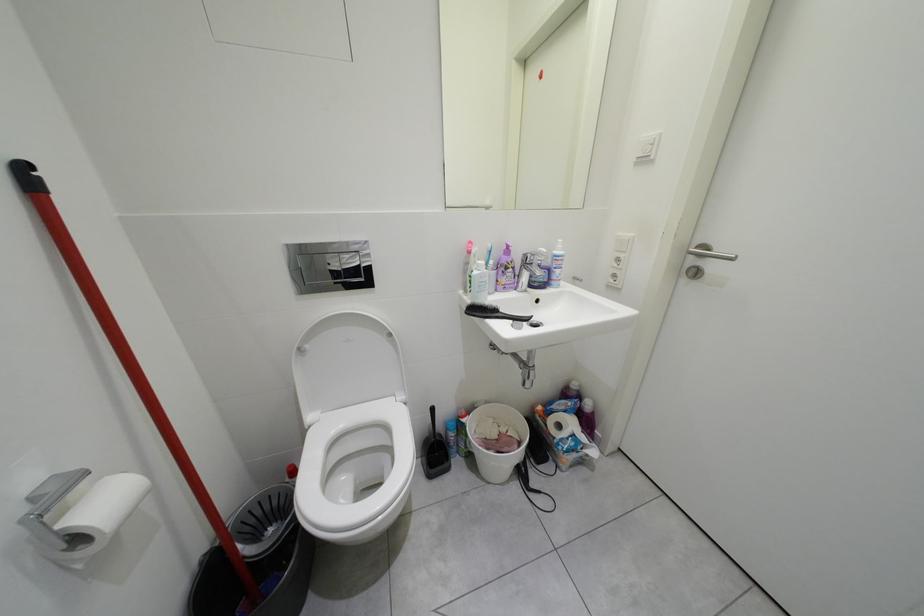
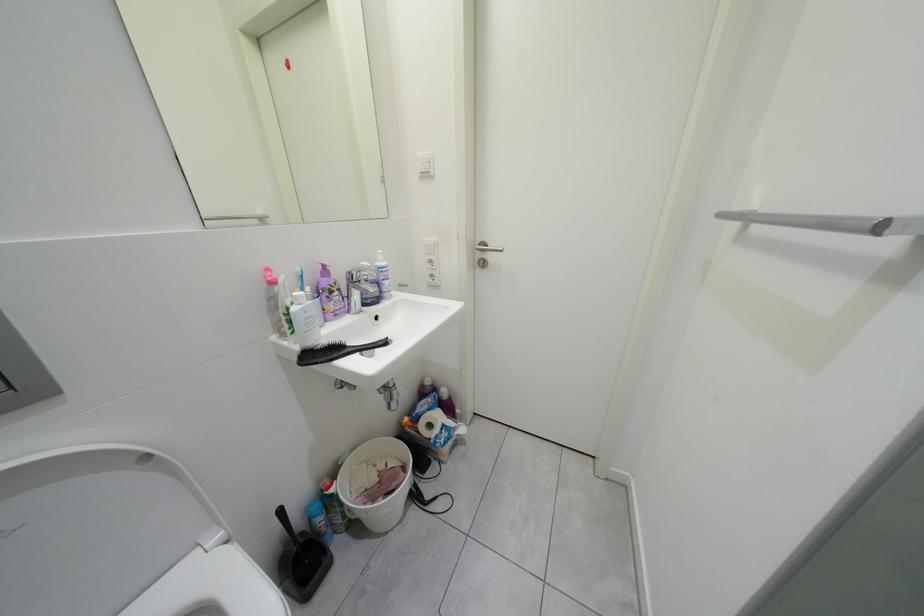
Question: The first image is from the beginning of the video and the second image is from the end. How did the camera likely rotate when shooting the video?

Choices:
 (A) Left
 (B) Right
 (C) Up
 (D) Down

Answer: (B)